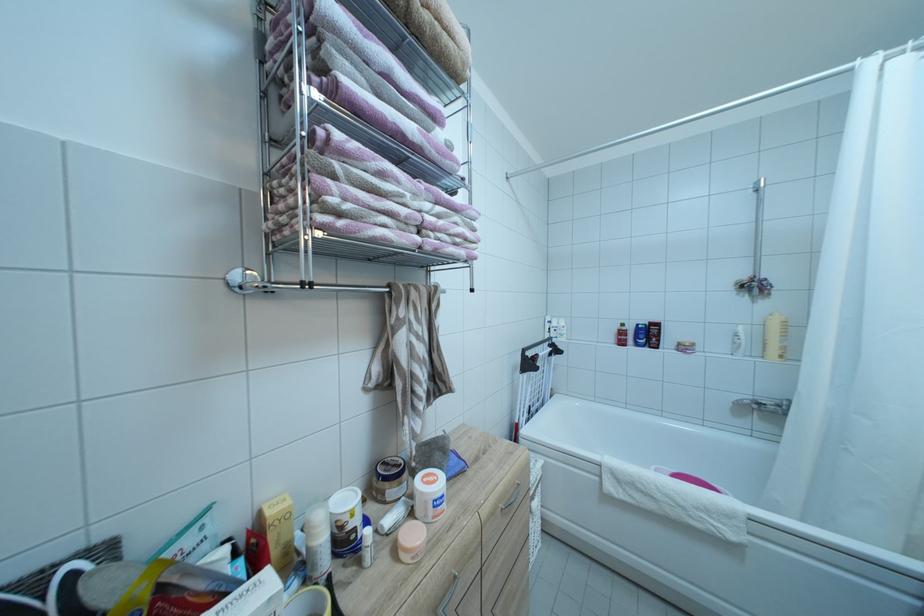
This screenshot has width=924, height=616. In order to click on patterned hand towel in this screenshot , I will do `click(357, 140)`.